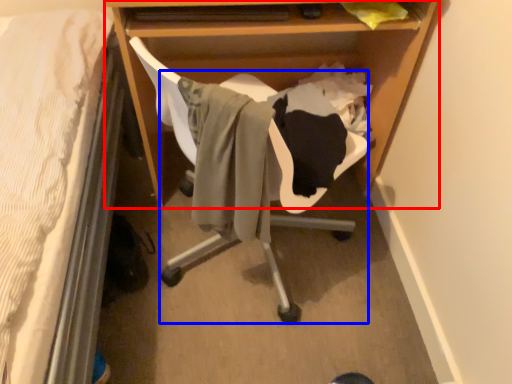
Question: Among these objects, which one is nearest to the camera, desk (highlighted by a red box) or swivel chair (highlighted by a blue box)?

Choices:
 (A) desk
 (B) swivel chair

Answer: (B)